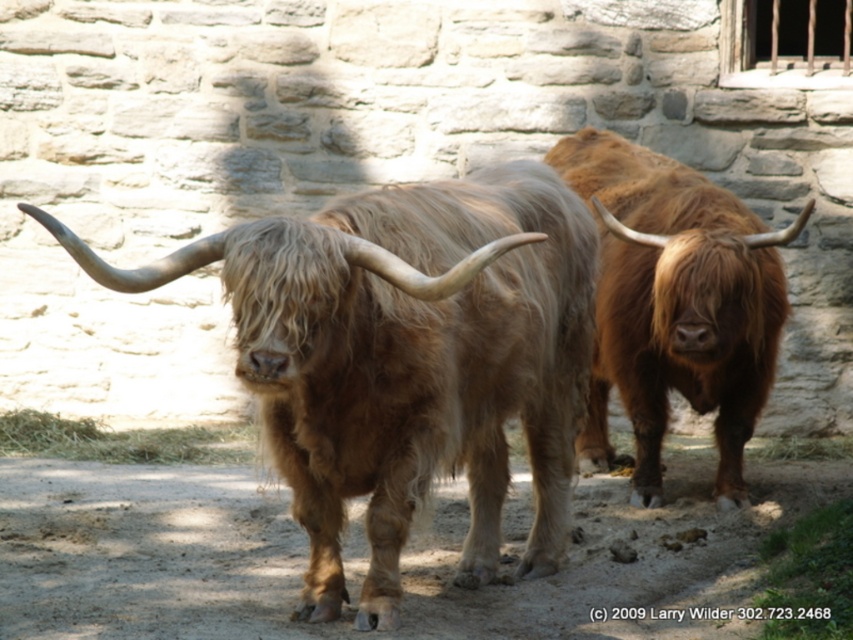
From the picture: You are a farmer who needs to separate two animals using a fence. You have a fence panel that is 38 inches long. The animals are the fuzzy brown yak at center and the brown fuzzy bull at center. Can the fence panel fit between them to separate them?

The fuzzy brown yak at center and the brown fuzzy bull at center are 38.80 inches apart. Since the fence panel is only 38 inches long, it is slightly shorter than the distance between them. Therefore, the fence panel cannot fully span the gap to separate the two animals.

You are standing in front of a stone wall with a barred window. You see a fuzzy brown yak at center and a brown fuzzy bull at center. Which animal is closer to you?

The fuzzy brown yak at center is closer to the viewer than the brown fuzzy bull at center.

You are a photographer trying to capture both the fuzzy brown yak at center and the brown fuzzy bull at center in the same frame. Based on their positions, which animal is blocking the view of the other from the photographer?

The brown fuzzy bull at center is blocking the view of the fuzzy brown yak at center because it is positioned above it.